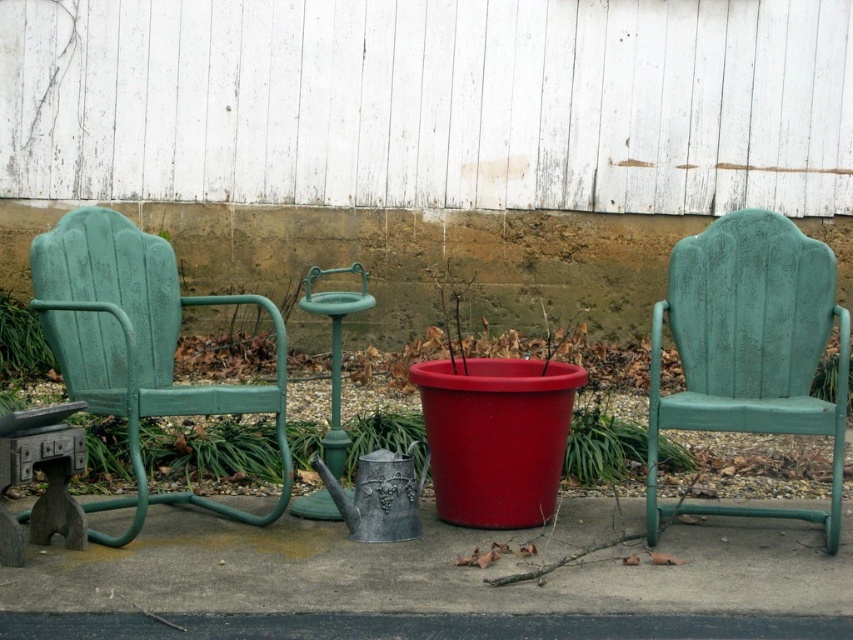
You are planning to place a large potted plant between the two chairs. Given the space between the green distressed wood chair at right and the green painted metal chair at left, will the plant fit if it requires 1 meter of space?

The green distressed wood chair at right has a lesser width compared to the green painted metal chair at left. However, the exact distance between them isn not specified in the provided description. Therefore, it is uncertain whether the plant requiring 1 meter of space will fit.

You are planning to place a rectangular table that is 6 feet long between the green distressed wood chair at right and the green painted metal chair at left. Based on the scene description, will the table fit comfortably between them without touching either chair?

The distance between the green distressed wood chair at right and the green painted metal chair at left is 6.49 feet. Since the table is 6 feet long, there will be approximately 0.49 feet of space remaining, which is about 5.88 inches. This might be tight but could work depending on the exact placement. However, the existing small round green metal table between them may already occupy some of that space, so it might not fit comfortably.